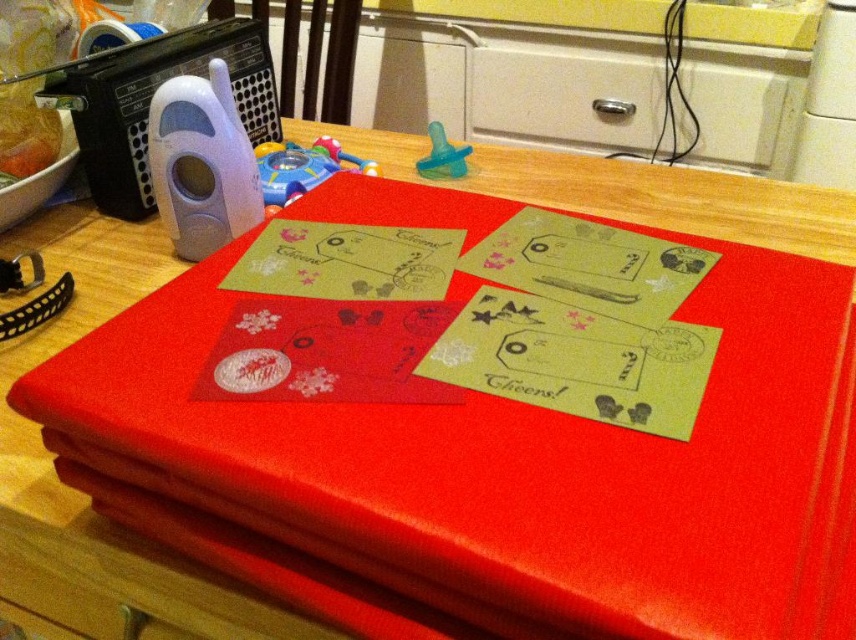
Question: Among these points, which one is farthest from the camera?

Choices:
 (A) (339, 161)
 (B) (263, 184)
 (C) (214, 248)
 (D) (637, 109)

Answer: (D)

Question: Which object is positioned closest to the white plastic remote control at upper left?

Choices:
 (A) translucent plastic toy at center
 (B) rubberized plastic toy at center
 (C) teal rubber pacifier at upper center

Answer: (A)

Question: Which object is positioned closest to the white matte drawer at upper center?

Choices:
 (A) white plastic remote control at upper left
 (B) rubberized plastic toy at center

Answer: (B)

Question: Can you confirm if white matte drawer at upper center is positioned to the left of rubberized plastic toy at center?

Choices:
 (A) yes
 (B) no

Answer: (B)

Question: Is white matte drawer at upper center thinner than teal rubber pacifier at upper center?

Choices:
 (A) yes
 (B) no

Answer: (B)

Question: Is white matte drawer at upper center smaller than teal rubber pacifier at upper center?

Choices:
 (A) yes
 (B) no

Answer: (B)